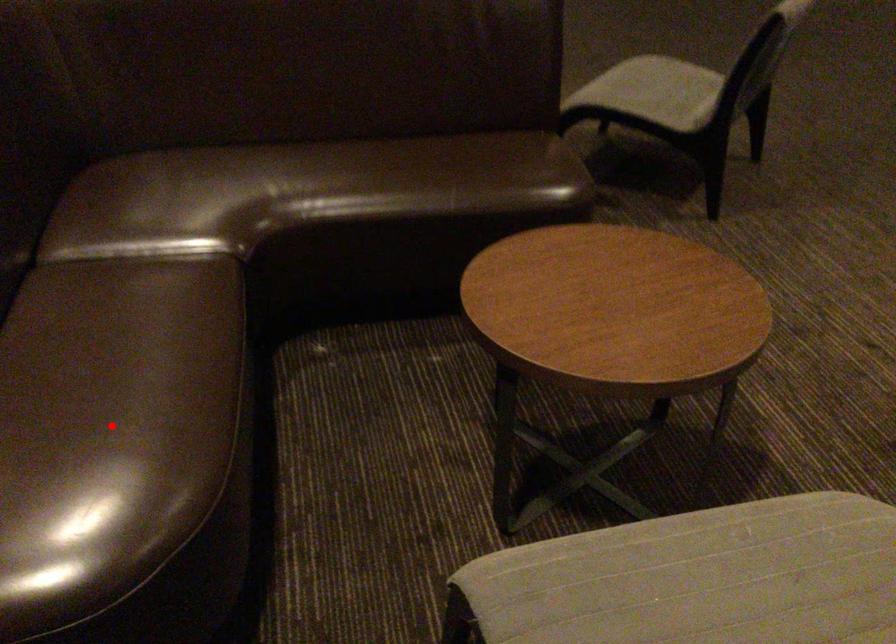
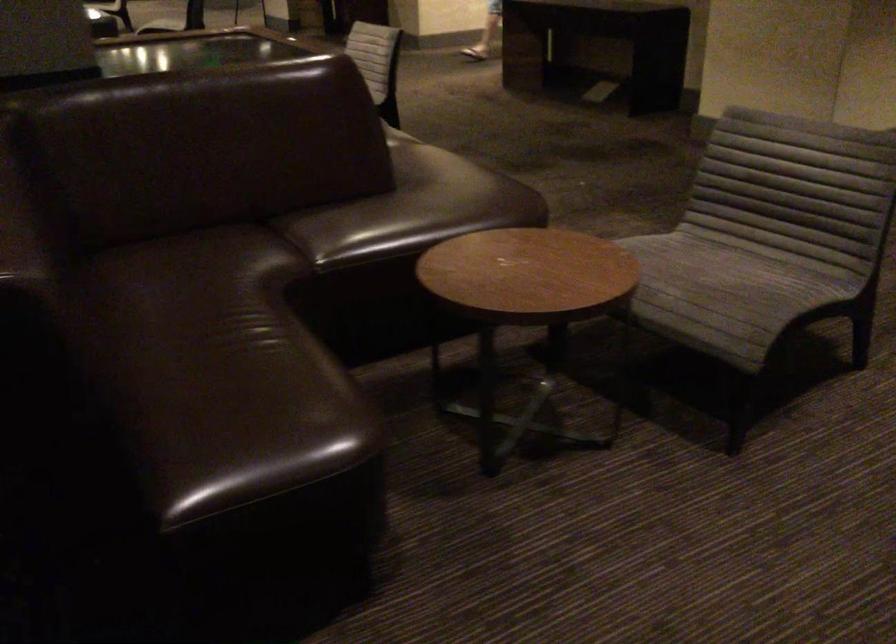
Question: I am providing you with two images of the same scene from different viewpoints. A red point is marked on the first image. Is the red point's position out of view in image 2?

Choices:
 (A) Yes
 (B) No

Answer: (A)